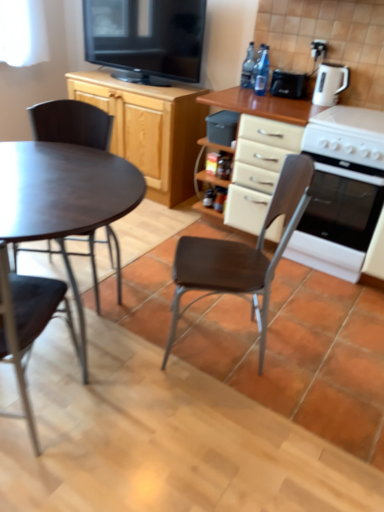
I want to click on blank area beneath brown leather chair at center, the third chair viewed from the left (from a real-world perspective), so click(221, 343).